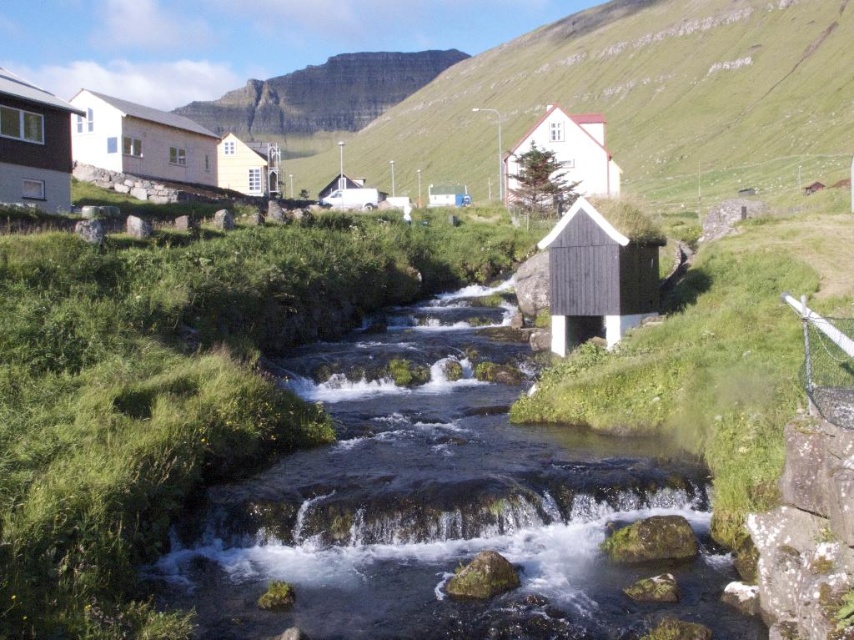
Does point (769, 80) come farther from viewer compared to point (0, 188)?

Yes.

Does green grassy hillside at upper center have a greater height compared to matte brown hut at left?

Yes.

Where is `green grassy hillside at upper center`? The image size is (854, 640). green grassy hillside at upper center is located at coordinates pyautogui.click(x=641, y=97).

Is black wood hut at center wider than matte brown hut at left?

No.

Who is lower down, black wood hut at center or matte brown hut at left?

Positioned lower is black wood hut at center.

Who is more distant from viewer, [636,317] or [53,157]?

Positioned behind is point [53,157].

Image resolution: width=854 pixels, height=640 pixels. Identify the location of black wood hut at center. (597, 276).

Between white wood cabin at left and matte brown hut at left, which one is positioned higher?

white wood cabin at left is higher up.

Which is below, white wood cabin at left or matte brown hut at left?

matte brown hut at left

Is point (127, 163) positioned after point (71, 166)?

Yes.

Where is `white wood cabin at left`? The width and height of the screenshot is (854, 640). white wood cabin at left is located at coordinates (141, 140).